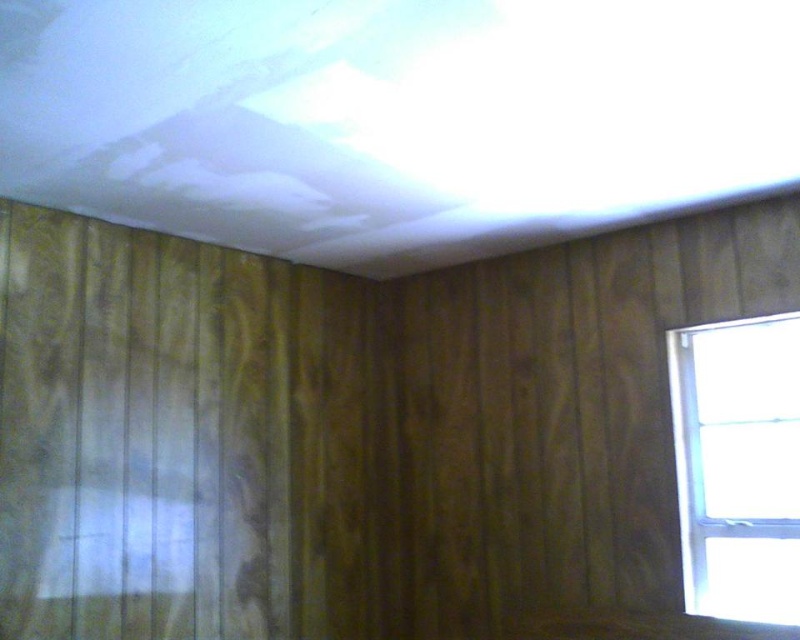
You are standing in the room and looking at the ceiling. There are two points marked on the ceiling at coordinates point (184, 376) and point (788, 477). Which point is closer to you?

Point (184, 376) is further to the camera than point (788, 477). Therefore, point (788, 477) is closer to you.

Consider the image. You are standing in the room and want to touch both the wooden paneling at left and the white plastic window at right. Which object will you reach first?

You will reach the wooden paneling at left first because it is closer to you than the white plastic window at right.